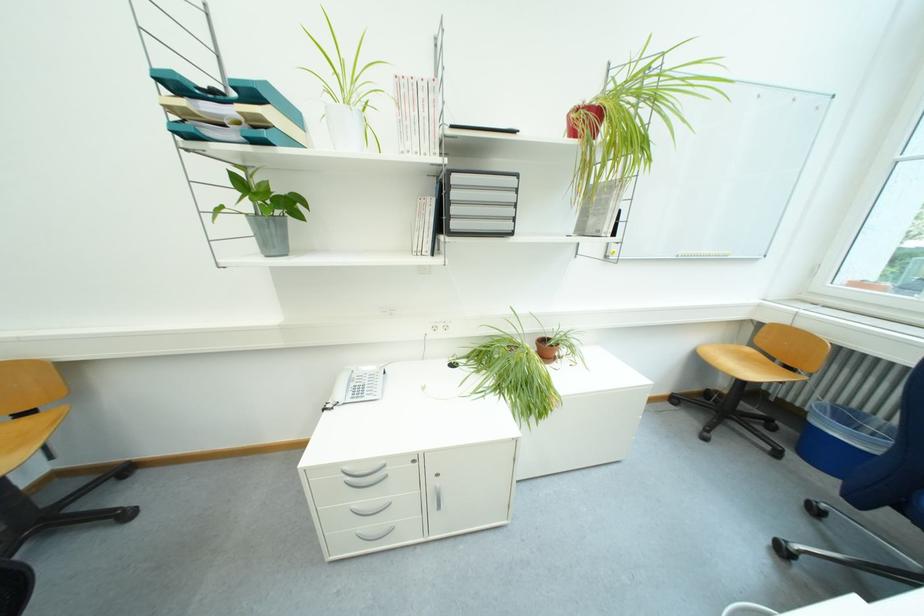
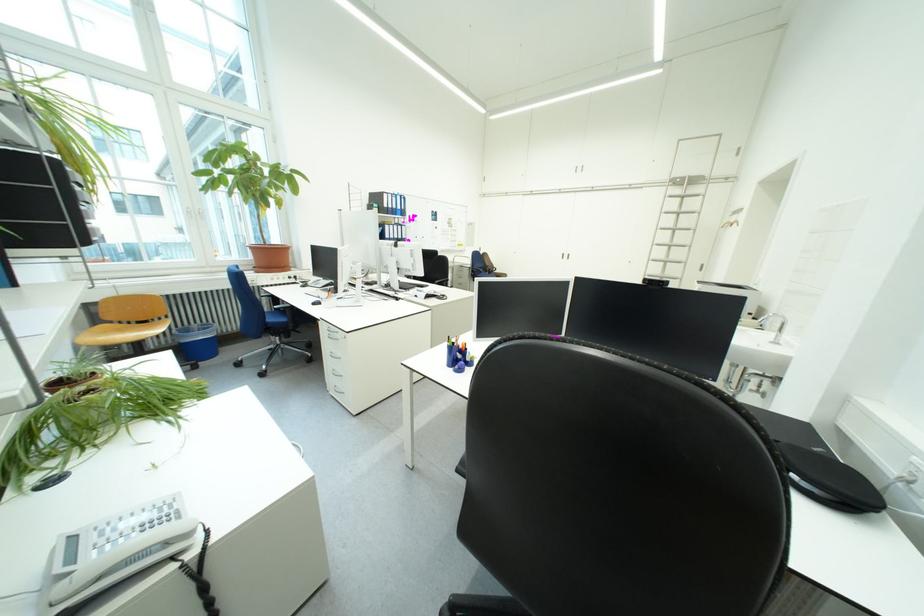
The point at (856, 418) is marked in the first image. Where is the corresponding point in the second image?

(199, 333)